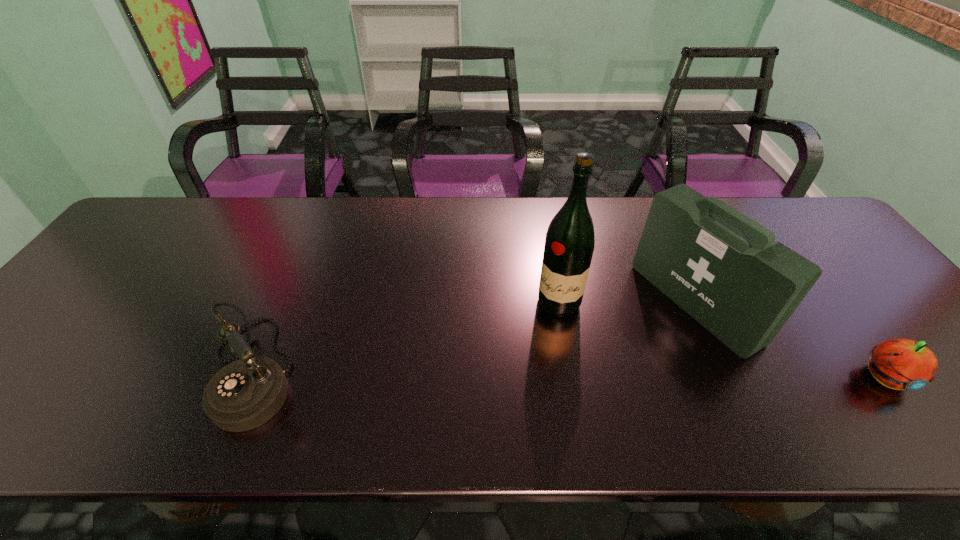
This screenshot has width=960, height=540. What are the coordinates of `vacant point located between the apple and the leftmost object` in the screenshot? It's located at (569, 373).

Locate an element on the screen. The image size is (960, 540). vacant space that's between the rightmost object and the third tallest object is located at coordinates (569, 373).

At what (x,y) coordinates should I click in order to perform the action: click on free space between the first-aid kit and the leftmost object. Please return your answer as a coordinate pair (x, y). The height and width of the screenshot is (540, 960). Looking at the image, I should click on (475, 336).

The width and height of the screenshot is (960, 540). I want to click on vacant area that lies between the third tallest object and the tallest object, so click(407, 336).

The width and height of the screenshot is (960, 540). In order to click on object that is the closest to the second object from left to right in this screenshot , I will do `click(724, 269)`.

Select which object is the closest to the telephone. Please provide its 2D coordinates. Your answer should be formatted as a tuple, i.e. [(x, y)], where the tuple contains the x and y coordinates of a point satisfying the conditions above.

[(569, 244)]